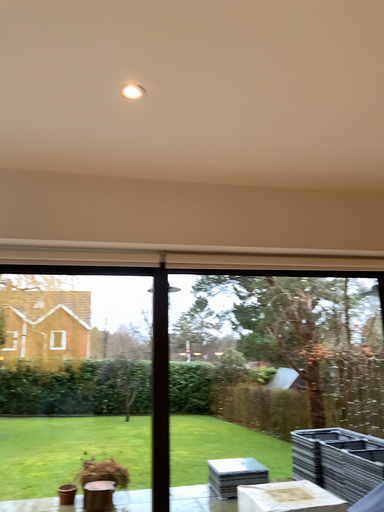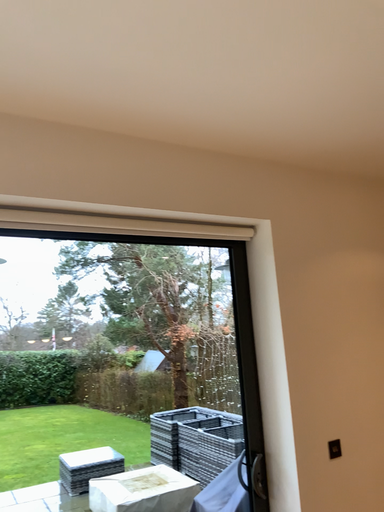
Question: Which way did the camera rotate in the video?

Choices:
 (A) rotated right
 (B) rotated left

Answer: (A)